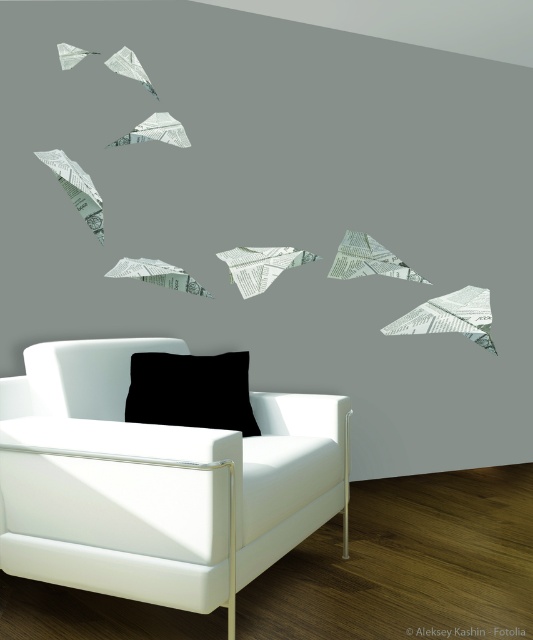
You are a delivery person trying to place a small package between the white leather armchair at lower left and the black matte pillow at lower center. Can you fit the package there if it measures 10 inches in length?

The distance between the white leather armchair at lower left and the black matte pillow at lower center is 9.40 inches, which is shorter than the package length of 10 inches. Therefore, the package cannot fit in that space.

You are standing in the living room and want to sit down. There is a white leather armchair at lower left located at point (x=157, y=481). Is the white leather armchair at lower left closer to the sofa or the wall?

The white leather armchair at lower left is closer to the sofa than the wall.

You are planning to place a small decorative item on the white leather armchair at lower left and the black matte pillow at lower center. Which object can accommodate the item better based on their sizes?

The white leather armchair at lower left has a larger size compared to the black matte pillow at lower center, so it can accommodate the small decorative item better.